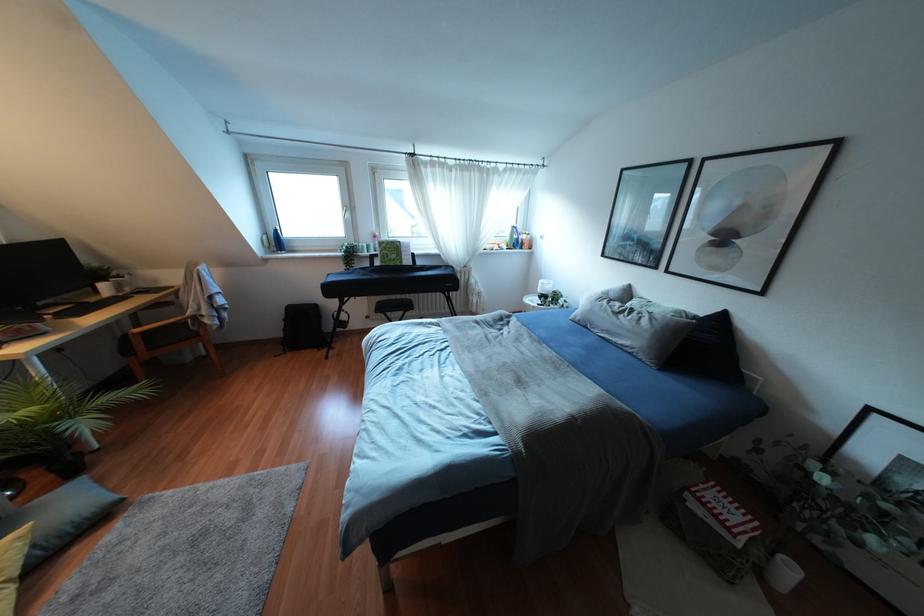
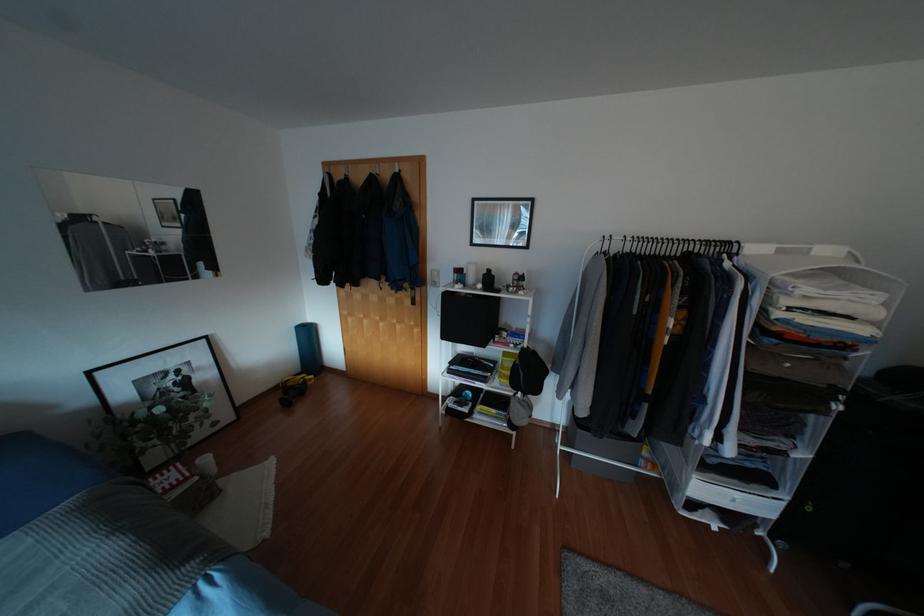
Where in the second image is the point corresponding to (791,570) from the first image?

(205, 459)